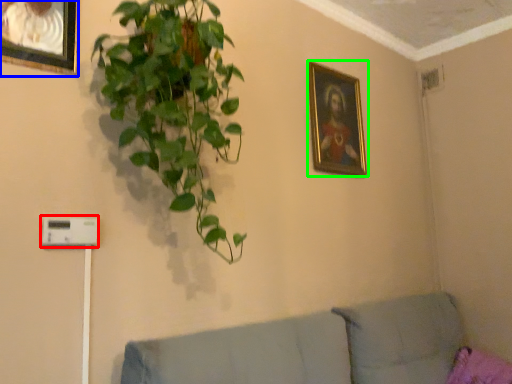
Question: Based on their relative distances, which object is farther from light switch (highlighted by a red box)? Choose from picture frame (highlighted by a blue box) and picture frame (highlighted by a green box).

Choices:
 (A) picture frame
 (B) picture frame

Answer: (B)